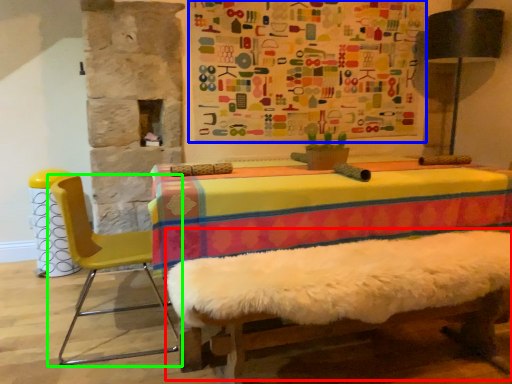
Question: Considering the real-world distances, which object is closest to bed frame (highlighted by a red box)? bulletin board (highlighted by a blue box) or chair (highlighted by a green box).

Choices:
 (A) bulletin board
 (B) chair

Answer: (B)